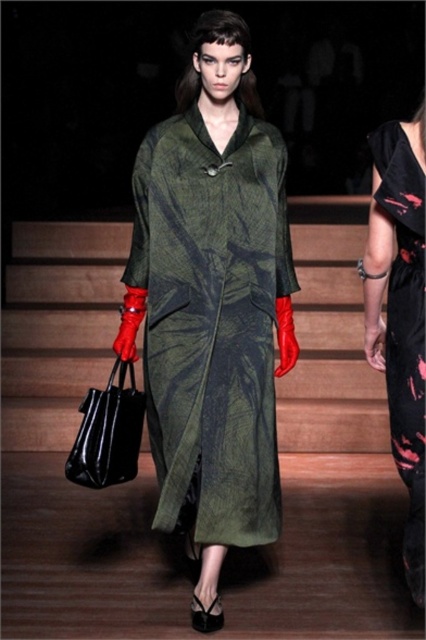
Which is more to the right, matte green dress at center or ripped black dress at right?

Positioned to the right is ripped black dress at right.

Does point (221, 115) lie in front of point (382, 355)?

Yes, point (221, 115) is in front of point (382, 355).

Who is more distant from viewer, (196, 65) or (403, 300)?

The point (196, 65) is more distant.

This screenshot has width=426, height=640. What are the coordinates of `matte green dress at center` in the screenshot? It's located at (212, 305).

Between ripped black dress at right and black leather bag at lower left, which one has less height?

black leather bag at lower left

Can you confirm if ripped black dress at right is taller than black leather bag at lower left?

Indeed, ripped black dress at right has a greater height compared to black leather bag at lower left.

Who is more forward, (414, 525) or (120, 403)?

Point (414, 525) is in front.

The image size is (426, 640). What are the coordinates of `ripped black dress at right` in the screenshot? It's located at (400, 314).

Is point (238, 355) farther from camera compared to point (135, 467)?

No, it is not.

Is matte green dress at center to the left of black leather bag at lower left from the viewer's perspective?

Result: Incorrect, matte green dress at center is not on the left side of black leather bag at lower left.

Locate an element on the screen. This screenshot has height=640, width=426. matte green dress at center is located at coordinates (212, 305).

This screenshot has width=426, height=640. I want to click on matte green dress at center, so click(x=212, y=305).